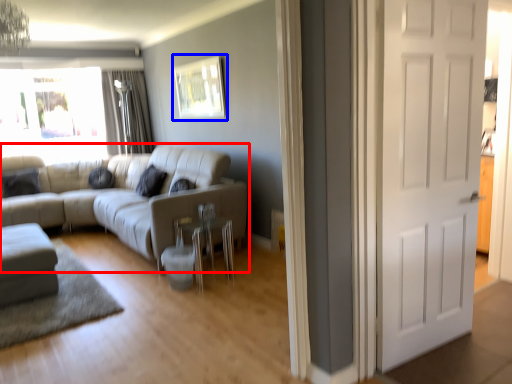
Question: Which of the following is the farthest to the observer, studio couch (highlighted by a red box) or picture frame (highlighted by a blue box)?

Choices:
 (A) studio couch
 (B) picture frame

Answer: (B)